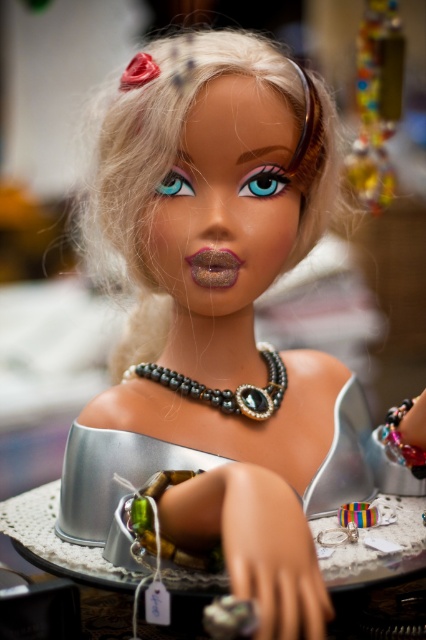
Is multicolored beaded necklace at upper right thinner than pearl and glass beads necklace at center?

Indeed, multicolored beaded necklace at upper right has a lesser width compared to pearl and glass beads necklace at center.

Measure the distance between point [377,49] and camera.

The distance of point [377,49] from camera is 33.18 inches.

Is point (383, 3) less distant than point (278, 353)?

No, it is not.

The width and height of the screenshot is (426, 640). I want to click on multicolored beaded necklace at upper right, so click(x=377, y=102).